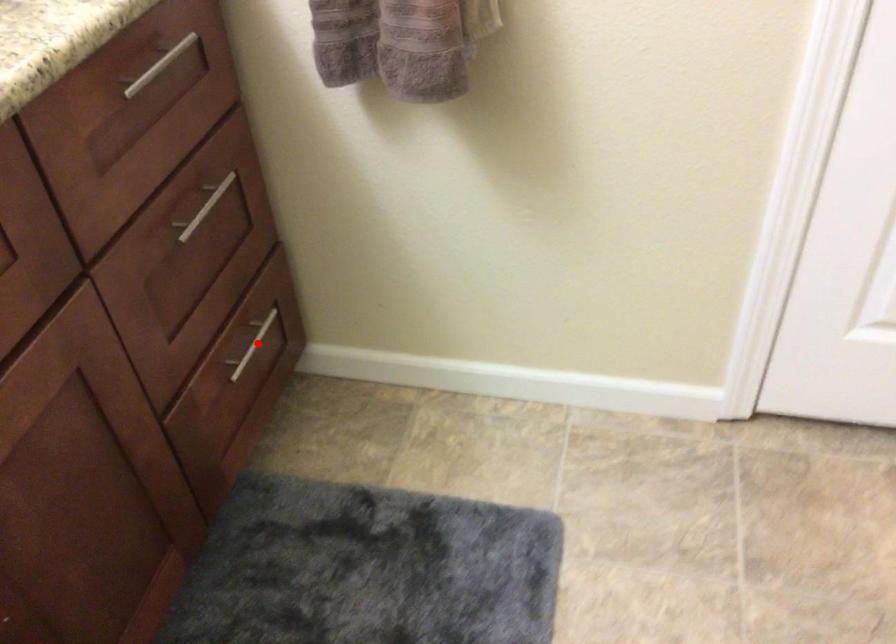
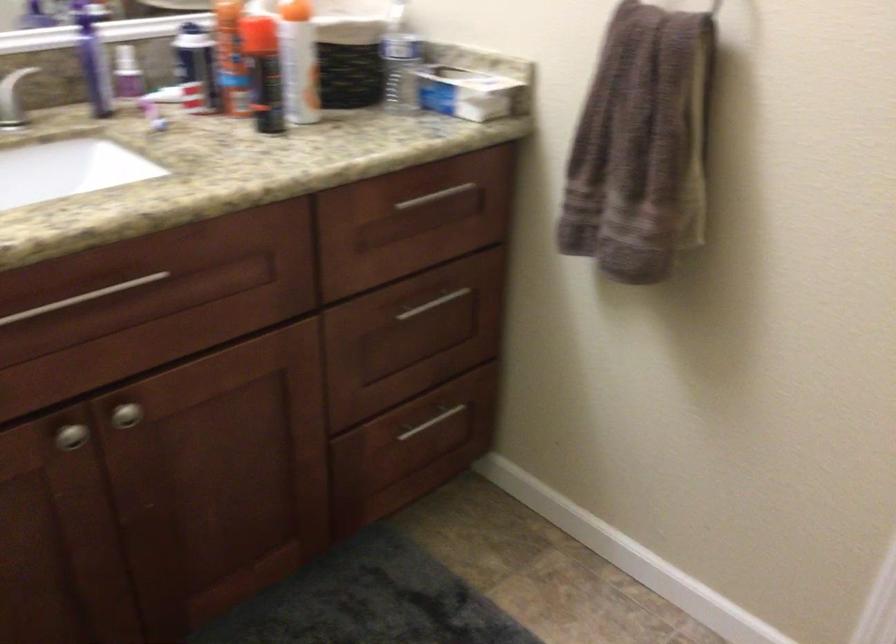
The point at the highlighted location is marked in the first image. Where is the corresponding point in the second image?

(432, 422)